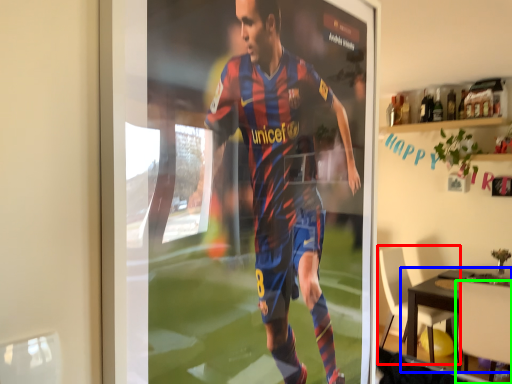
Question: Which object is positioned closest to chair (highlighted by a red box)? Select from table (highlighted by a blue box) and chair (highlighted by a green box).

Choices:
 (A) table
 (B) chair

Answer: (A)